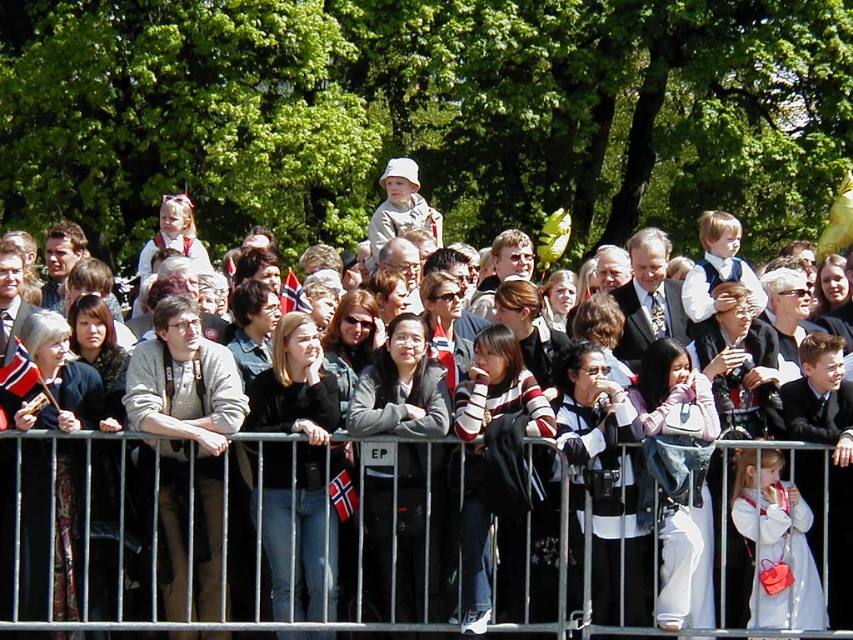
Who is positioned more to the left, dark gray jacket at center or black leather jacket at center?

Positioned to the left is black leather jacket at center.

Between dark gray jacket at center and black leather jacket at center, which one is positioned higher?

Positioned higher is dark gray jacket at center.

Does point (397, 403) come behind point (317, 419)?

Yes, point (397, 403) is farther from viewer.

Identify the location of dark gray jacket at center. (399, 387).

Does black leather jacket at center lie behind metallic silver fence at center?

Yes, black leather jacket at center is further from the viewer.

Does black leather jacket at center appear over metallic silver fence at center?

No, black leather jacket at center is not above metallic silver fence at center.

Between point (270, 381) and point (820, 449), which one is positioned in front?

Point (820, 449)

Locate an element on the screen. black leather jacket at center is located at coordinates (296, 468).

Does light brown sweater at center appear on the left side of metallic silver fence at center?

Correct, you'll find light brown sweater at center to the left of metallic silver fence at center.

Is point (201, 337) less distant than point (585, 529)?

No.

Locate an element on the screen. light brown sweater at center is located at coordinates (186, 448).